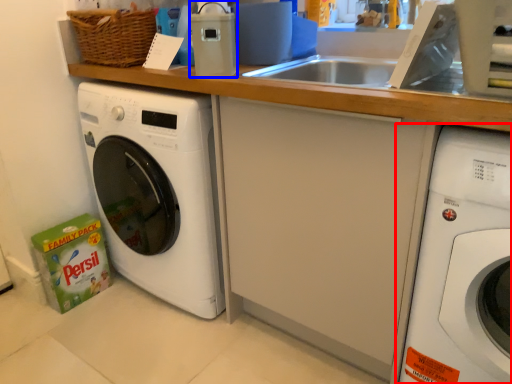
Question: Among these objects, which one is farthest to the camera, washing machine (highlighted by a red box) or appliance (highlighted by a blue box)?

Choices:
 (A) washing machine
 (B) appliance

Answer: (B)